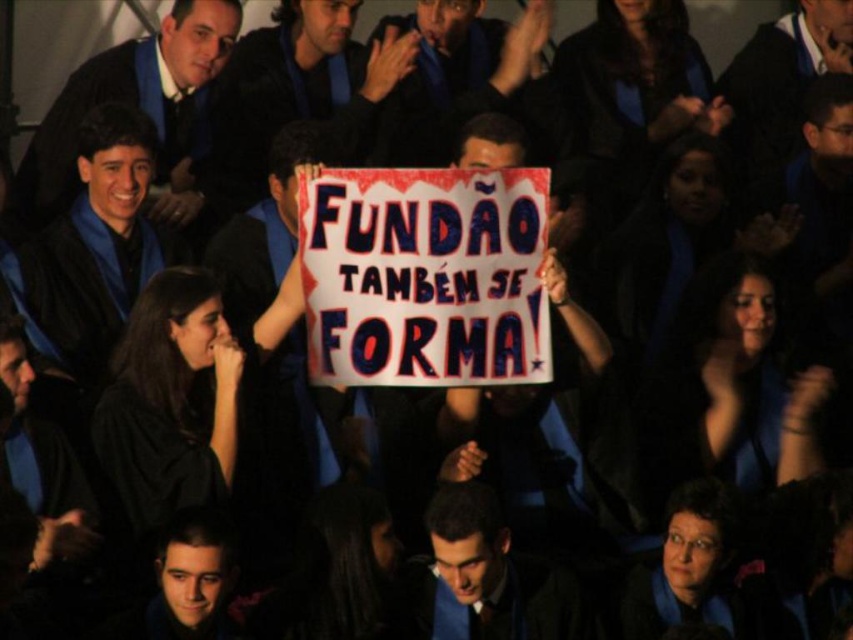
Question: Which object is farther from the camera taking this photo?

Choices:
 (A) matte blue suit at center
 (B) matte black graduation gown at upper center
 (C) matte black graduation gown at left
 (D) smooth skin face at center

Answer: (B)

Question: Is matte black graduation gown at upper center to the right of smooth skin face at center from the viewer's perspective?

Choices:
 (A) yes
 (B) no

Answer: (A)

Question: Considering the real-world distances, which object is closest to the matte black graduation gown at center?

Choices:
 (A) matte black graduation gown at upper center
 (B) matte blue suit at center

Answer: (A)

Question: Which point is farther to the camera?

Choices:
 (A) matte black graduation gown at upper left
 (B) matte black graduation gown at center

Answer: (B)

Question: Is matte black graduation gown at center closer to the viewer compared to matte black graduation gown at upper center?

Choices:
 (A) no
 (B) yes

Answer: (B)

Question: Does matte black graduation gown at left appear on the right side of matte black graduation gown at upper center?

Choices:
 (A) no
 (B) yes

Answer: (A)